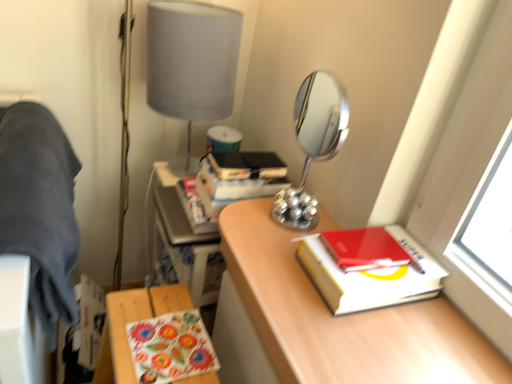
Question: Can you confirm if chrome/metallic mirror at center is bigger than dark blue fabric at left?

Choices:
 (A) yes
 (B) no

Answer: (B)

Question: From the image's perspective, is chrome/metallic mirror at center located beneath dark blue fabric at left?

Choices:
 (A) yes
 (B) no

Answer: (B)

Question: Is chrome/metallic mirror at center further to the viewer compared to dark blue fabric at left?

Choices:
 (A) yes
 (B) no

Answer: (A)

Question: Can we say chrome/metallic mirror at center lies outside dark blue fabric at left?

Choices:
 (A) no
 (B) yes

Answer: (B)

Question: Considering the relative positions of chrome/metallic mirror at center and dark blue fabric at left in the image provided, is chrome/metallic mirror at center to the right of dark blue fabric at left from the viewer's perspective?

Choices:
 (A) yes
 (B) no

Answer: (A)

Question: Considering the relative positions of chrome/metallic mirror at center and dark blue fabric at left in the image provided, is chrome/metallic mirror at center to the left of dark blue fabric at left from the viewer's perspective?

Choices:
 (A) yes
 (B) no

Answer: (B)

Question: Can you confirm if matte gray lampshade at upper center is taller than wooden desk at center?

Choices:
 (A) no
 (B) yes

Answer: (A)

Question: Does matte gray lampshade at upper center appear on the left side of wooden desk at center?

Choices:
 (A) yes
 (B) no

Answer: (B)

Question: Considering the relative sizes of matte gray lampshade at upper center and wooden desk at center in the image provided, is matte gray lampshade at upper center bigger than wooden desk at center?

Choices:
 (A) yes
 (B) no

Answer: (B)

Question: Is wooden desk at center located within matte gray lampshade at upper center?

Choices:
 (A) no
 (B) yes

Answer: (A)

Question: Is matte gray lampshade at upper center smaller than wooden desk at center?

Choices:
 (A) yes
 (B) no

Answer: (A)

Question: Does matte gray lampshade at upper center have a greater width compared to wooden desk at center?

Choices:
 (A) yes
 (B) no

Answer: (B)

Question: From a real-world perspective, is chrome/metallic mirror at center under matte gray lampshade at upper center?

Choices:
 (A) yes
 (B) no

Answer: (B)